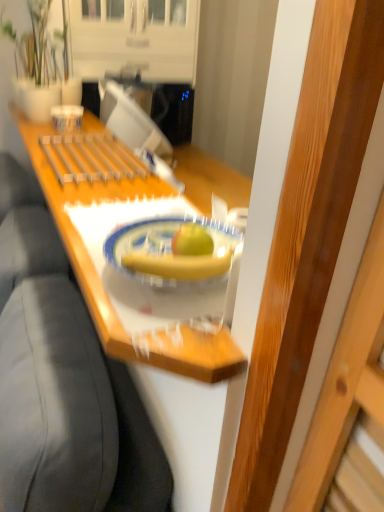
Question: From the image's perspective, does wooden tray at center appear higher than matte white vase at upper left?

Choices:
 (A) yes
 (B) no

Answer: (B)

Question: Is wooden tray at center turned away from matte white vase at upper left?

Choices:
 (A) no
 (B) yes

Answer: (A)

Question: Is matte white vase at upper left located within wooden tray at center?

Choices:
 (A) yes
 (B) no

Answer: (B)

Question: Can you confirm if wooden tray at center is thinner than matte white vase at upper left?

Choices:
 (A) yes
 (B) no

Answer: (A)

Question: From a real-world perspective, is wooden tray at center beneath matte white vase at upper left?

Choices:
 (A) yes
 (B) no

Answer: (A)

Question: Is wooden tray at center bigger than matte white vase at upper left?

Choices:
 (A) yes
 (B) no

Answer: (A)

Question: Considering the relative sizes of matte white vase at upper left and yellow matte banana at center in the image provided, is matte white vase at upper left thinner than yellow matte banana at center?

Choices:
 (A) no
 (B) yes

Answer: (A)

Question: Is matte white vase at upper left to the left of yellow matte banana at center from the viewer's perspective?

Choices:
 (A) yes
 (B) no

Answer: (A)

Question: Is yellow matte banana at center completely or partially inside matte white vase at upper left?

Choices:
 (A) no
 (B) yes

Answer: (A)

Question: Does matte white vase at upper left come in front of yellow matte banana at center?

Choices:
 (A) no
 (B) yes

Answer: (A)

Question: From a real-world perspective, is matte white vase at upper left over yellow matte banana at center?

Choices:
 (A) yes
 (B) no

Answer: (A)

Question: Does matte white vase at upper left have a lesser height compared to yellow matte banana at center?

Choices:
 (A) yes
 (B) no

Answer: (B)

Question: Considering the relative sizes of yellow matte banana at center and porcelain plate at center in the image provided, is yellow matte banana at center thinner than porcelain plate at center?

Choices:
 (A) yes
 (B) no

Answer: (A)